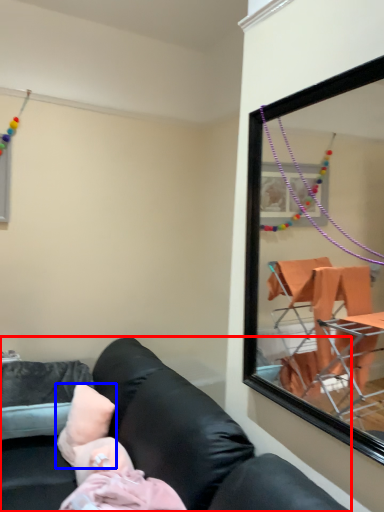
Question: Among these objects, which one is nearest to the camera, studio couch (highlighted by a red box) or pillow (highlighted by a blue box)?

Choices:
 (A) studio couch
 (B) pillow

Answer: (A)